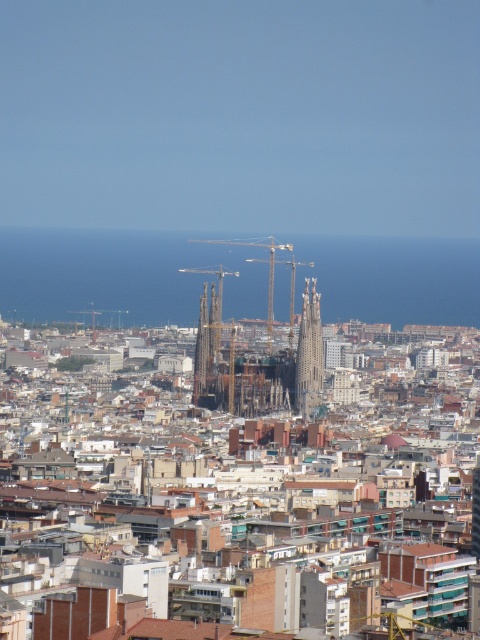
Who is more forward, (305, 380) or (217, 333)?

Point (217, 333) is more forward.

Locate an element on the screen. gray stone tower at center is located at coordinates (309, 353).

Locate an element on the screen. The image size is (480, 640). gray stone tower at center is located at coordinates (309, 353).